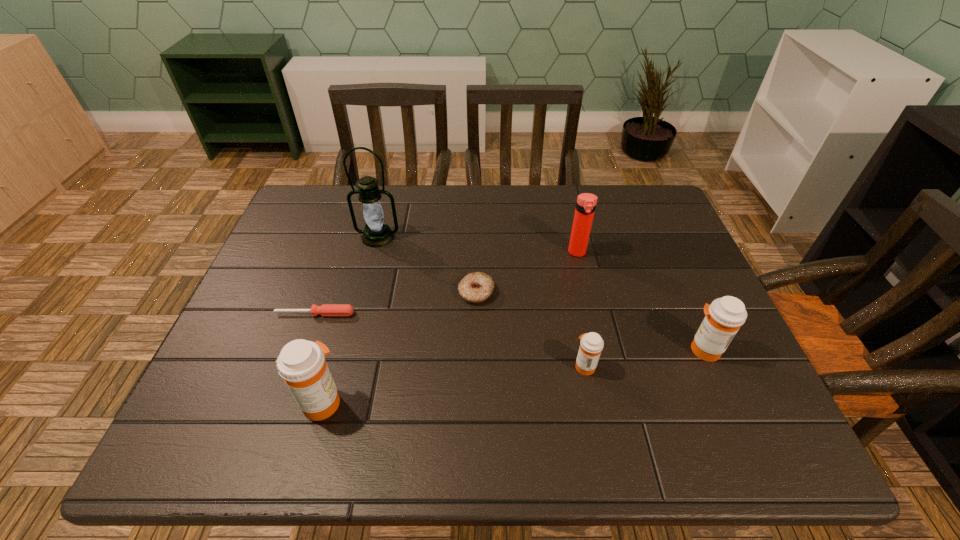
Locate an element on the screen. the nearest medicine is located at coordinates [301, 364].

Locate an element on the screen. The height and width of the screenshot is (540, 960). the leftmost medicine is located at coordinates (301, 364).

At what (x,y) coordinates should I click in order to perform the action: click on the second medicine from right to left. Please return your answer as a coordinate pair (x, y). Looking at the image, I should click on (591, 344).

Find the location of a particular element. the third shortest object is located at coordinates tap(591, 344).

Where is `the fourth shortest object`? the fourth shortest object is located at coordinates (723, 318).

The width and height of the screenshot is (960, 540). In order to click on the second tallest medicine in this screenshot , I will do `click(723, 318)`.

Locate an element on the screen. the tallest object is located at coordinates (377, 233).

Find the location of `thermos bottle`. thermos bottle is located at coordinates (586, 203).

In order to click on doughnut in this screenshot , I will do `click(476, 287)`.

You are a GUI agent. You are given a task and a screenshot of the screen. Output one action in this format:
    pyautogui.click(x=<x>, y=<y>)
    Task: Click on the third farthest object
    
    Given the screenshot: What is the action you would take?
    pyautogui.click(x=476, y=287)